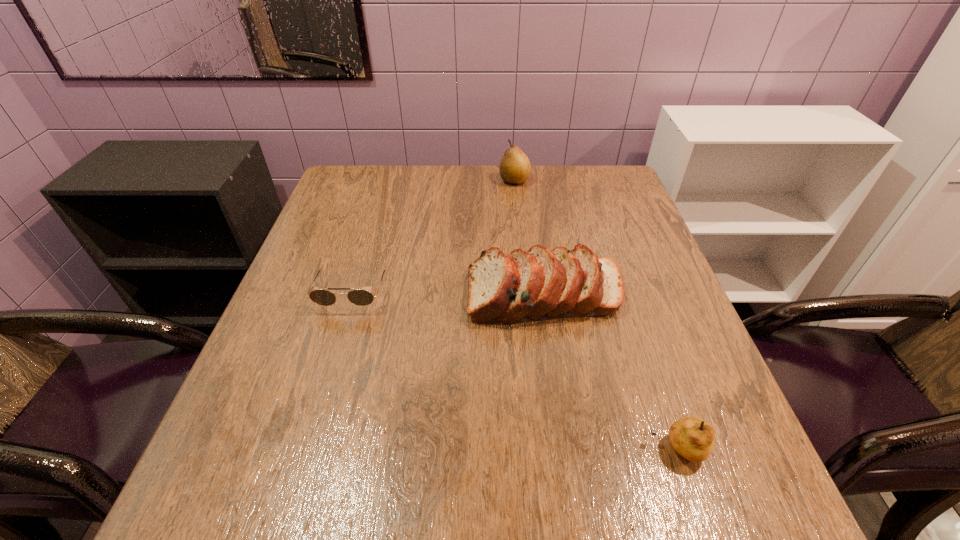
Find the location of a particular element. free space located 0.190m on the front lenses of the shortest object is located at coordinates (324, 389).

Where is `object that is at the far edge`? Image resolution: width=960 pixels, height=540 pixels. object that is at the far edge is located at coordinates (514, 168).

Locate an element on the screen. Image resolution: width=960 pixels, height=540 pixels. object located in the left edge section of the desktop is located at coordinates (359, 297).

At what (x,y) coordinates should I click in order to perform the action: click on bread at the right edge. Please return your answer as a coordinate pair (x, y). The width and height of the screenshot is (960, 540). Looking at the image, I should click on (541, 284).

This screenshot has height=540, width=960. What are the coordinates of `pear that is positioned at the right edge` in the screenshot? It's located at (691, 437).

The width and height of the screenshot is (960, 540). Find the location of `vacant space at the far edge of the desktop`. vacant space at the far edge of the desktop is located at coordinates (559, 175).

In the image, there is a desktop. Identify the location of vacant region at the left edge. (323, 274).

Locate an element on the screen. free space at the right edge of the desktop is located at coordinates (691, 377).

At what (x,y) coordinates should I click in order to perform the action: click on free space at the far left corner. Please return your answer as a coordinate pair (x, y). The height and width of the screenshot is (540, 960). Looking at the image, I should click on (343, 174).

Identify the location of vacant space at the near left corner of the desktop. (293, 490).